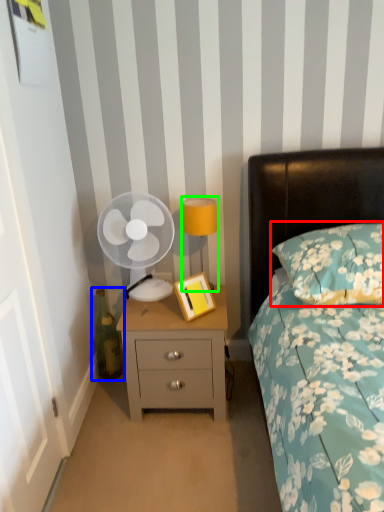
Question: Which is nearer to the pillow (highlighted by a red box)? bottle (highlighted by a blue box) or bedside lamp (highlighted by a green box).

Choices:
 (A) bottle
 (B) bedside lamp

Answer: (B)